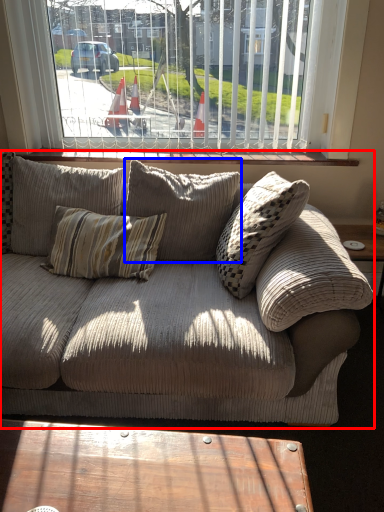
Question: Which object is further to the camera taking this photo, studio couch (highlighted by a red box) or pillow (highlighted by a blue box)?

Choices:
 (A) studio couch
 (B) pillow

Answer: (B)